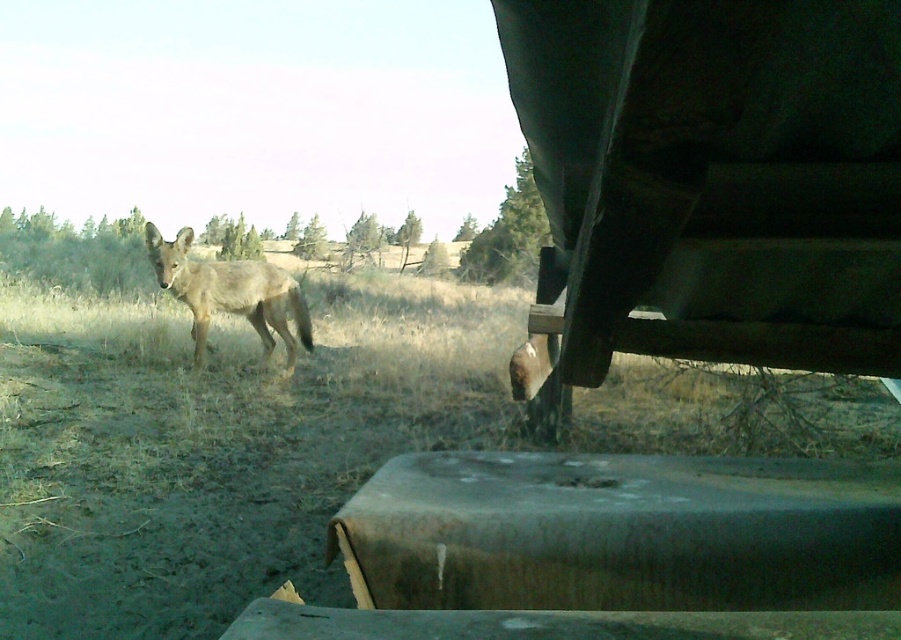
Question: Which object appears farthest from the camera in this image?

Choices:
 (A) fuzzy brown coyote at center
 (B) dry grass at center

Answer: (A)

Question: Can you confirm if dry grass at center is smaller than fuzzy brown coyote at center?

Choices:
 (A) yes
 (B) no

Answer: (B)

Question: Does dry grass at center appear under fuzzy brown coyote at center?

Choices:
 (A) yes
 (B) no

Answer: (A)

Question: Can you confirm if dry grass at center is bigger than fuzzy brown coyote at center?

Choices:
 (A) no
 (B) yes

Answer: (B)

Question: Which point is closer to the camera taking this photo?

Choices:
 (A) (166, 461)
 (B) (296, 310)

Answer: (A)